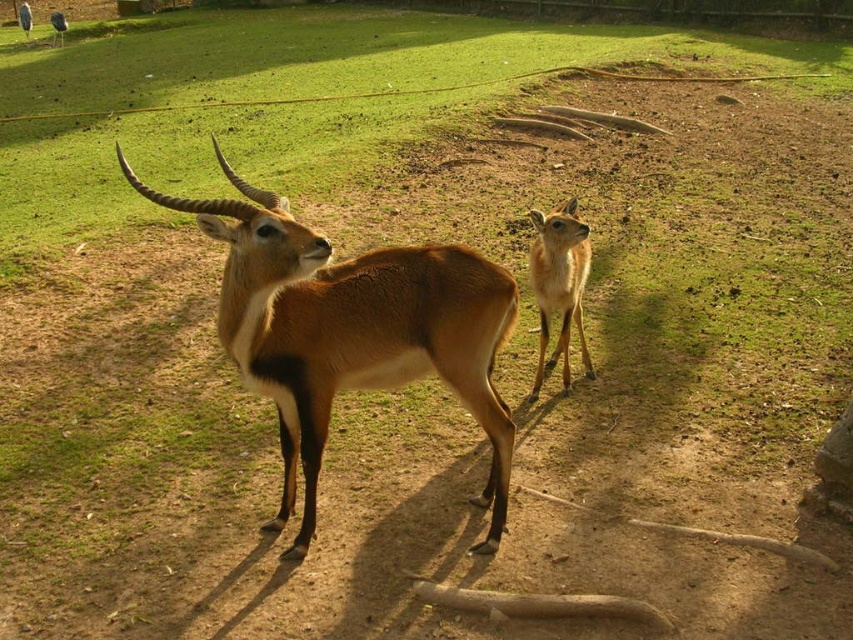
You are a wildlife photographer trying to capture a photo of both the brown glossy antelope at center and the light brown fur at center. Based on their positions, which one is closer to the camera?

The brown glossy antelope at center is closer to the camera because it is positioned below the light brown fur at center, indicating it is in the foreground.

You are a photographer trying to capture both the green grass at center and the brown glossy antelope at center in a single frame. Based on their sizes, which object should you focus on first to ensure both are in the frame?

The green grass at center has a larger size compared to the brown glossy antelope at center, so you should focus on the green grass at center first to ensure both are in the frame.